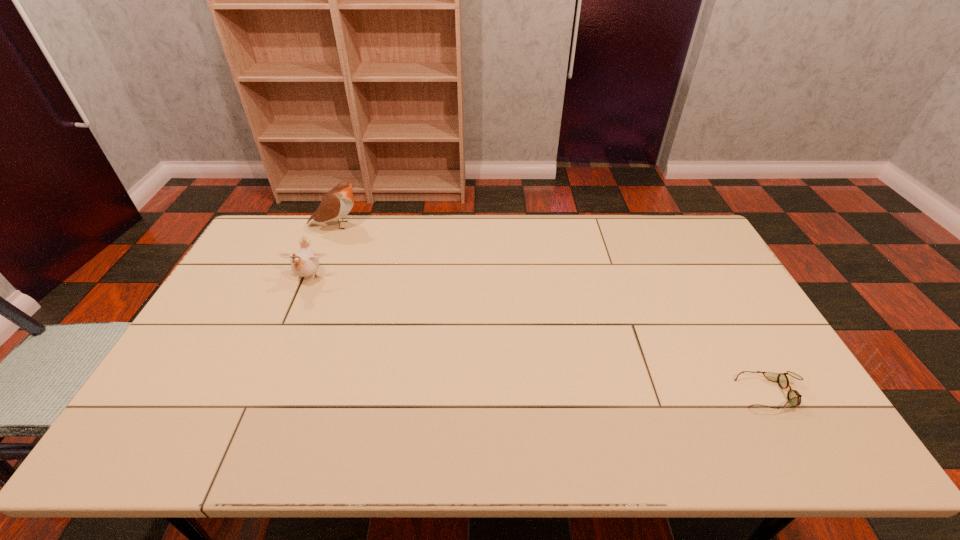
Where is `the tallest object`? the tallest object is located at coordinates (337, 203).

This screenshot has height=540, width=960. In order to click on the farthest object in this screenshot , I will do `click(337, 203)`.

At what (x,y) coordinates should I click in order to perform the action: click on the second farthest object. Please return your answer as a coordinate pair (x, y). This screenshot has height=540, width=960. Looking at the image, I should click on (305, 262).

What are the coordinates of `the shorter bird` in the screenshot? It's located at (305, 262).

The image size is (960, 540). I want to click on the shortest object, so click(x=794, y=398).

Identify the location of the rightmost object. This screenshot has width=960, height=540. (794, 398).

Identify the location of vacant space situated 0.210m at the face of the taller bird. (420, 225).

Identify the location of vacant space located at the beak of the shorter bird. Image resolution: width=960 pixels, height=540 pixels. (295, 312).

This screenshot has height=540, width=960. I want to click on vacant point located 0.190m on the front-facing side of the nearest object, so click(x=664, y=394).

What are the coordinates of `free space located on the front-facing side of the nearest object` in the screenshot? It's located at (708, 394).